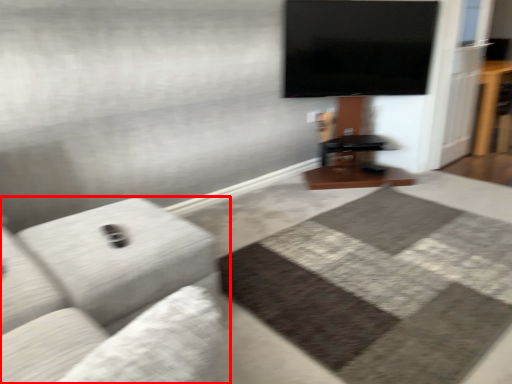
Question: From the image, what is the correct spatial relationship of studio couch (annotated by the red box) in relation to table?

Choices:
 (A) right
 (B) left

Answer: (B)